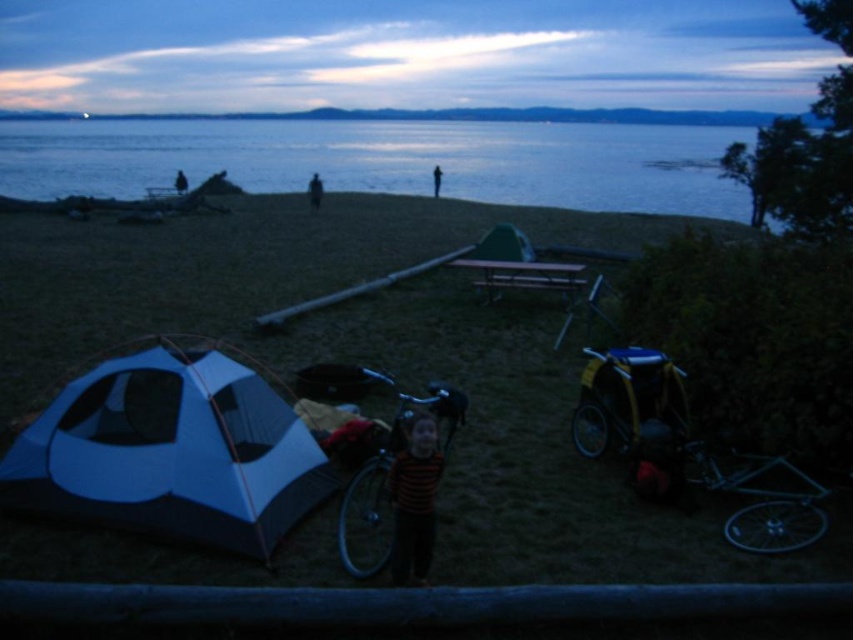
You are a hiker who wants to set up a tent. You see the striped fabric at center and the dark blue fabric tent at center. Which object is closer to the ground?

The striped fabric at center is below the dark blue fabric tent at center, so the striped fabric at center is closer to the ground.

You are standing at the point with coordinates point (317, 186) and want to see the point (117, 376). Is there an unobstructed view between these two points?

Point (117, 376) is in front of point (317, 186), so there is an obstruction between them.